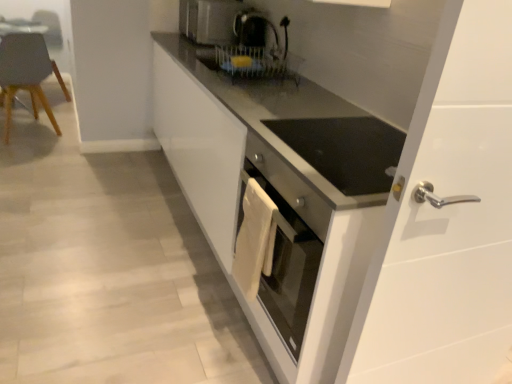
Question: Can you confirm if black glossy coffee machine at upper center is positioned to the left of matte gray chair at left?

Choices:
 (A) no
 (B) yes

Answer: (A)

Question: Is black glossy coffee machine at upper center looking in the opposite direction of matte gray chair at left?

Choices:
 (A) no
 (B) yes

Answer: (A)

Question: Can you confirm if black glossy coffee machine at upper center is smaller than matte gray chair at left?

Choices:
 (A) no
 (B) yes

Answer: (B)

Question: Is black glossy coffee machine at upper center aimed at matte gray chair at left?

Choices:
 (A) yes
 (B) no

Answer: (B)

Question: Is black glossy coffee machine at upper center not within matte gray chair at left?

Choices:
 (A) yes
 (B) no

Answer: (A)

Question: Is satin silver toaster at upper center wider or thinner than matte gray chair at left?

Choices:
 (A) thin
 (B) wide

Answer: (A)

Question: In the image, is satin silver toaster at upper center on the left side or the right side of matte gray chair at left?

Choices:
 (A) left
 (B) right

Answer: (B)

Question: Considering the positions of point (242, 3) and point (40, 66), is point (242, 3) closer or farther from the camera than point (40, 66)?

Choices:
 (A) farther
 (B) closer

Answer: (B)

Question: Is satin silver toaster at upper center inside the boundaries of matte gray chair at left, or outside?

Choices:
 (A) outside
 (B) inside

Answer: (A)

Question: Based on their positions, is matte gray chair at left located to the left or right of white glossy cabinet at center?

Choices:
 (A) right
 (B) left

Answer: (B)

Question: In the image, is matte gray chair at left positioned in front of or behind white glossy cabinet at center?

Choices:
 (A) behind
 (B) front

Answer: (A)

Question: From the image's perspective, is matte gray chair at left positioned above or below white glossy cabinet at center?

Choices:
 (A) below
 (B) above

Answer: (B)

Question: Considering the positions of point (3, 91) and point (465, 135), is point (3, 91) closer or farther from the camera than point (465, 135)?

Choices:
 (A) closer
 (B) farther

Answer: (B)

Question: Visually, is white glossy cabinet at center positioned to the left or to the right of matte gray chair at left?

Choices:
 (A) left
 (B) right

Answer: (B)

Question: From a real-world perspective, is white glossy cabinet at center positioned above or below matte gray chair at left?

Choices:
 (A) above
 (B) below

Answer: (A)